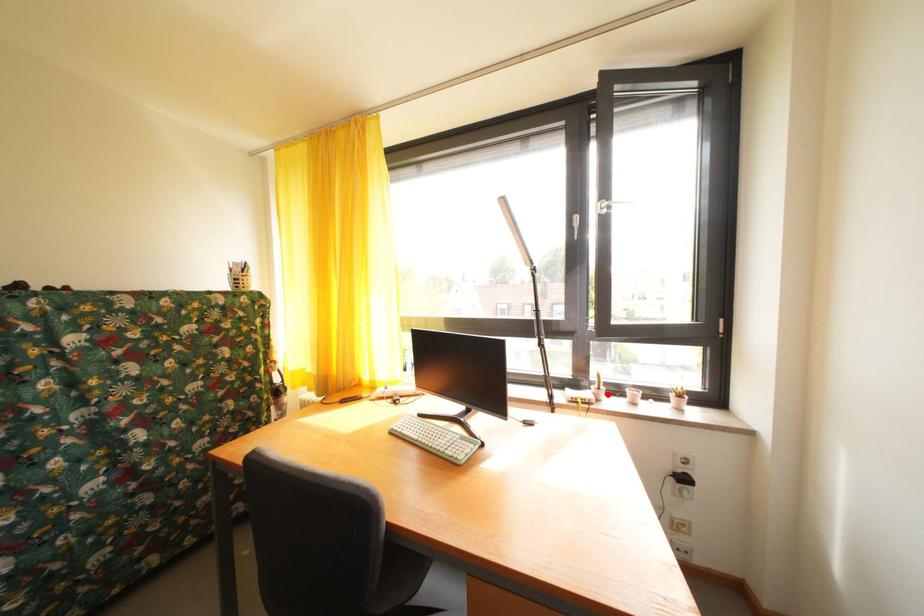
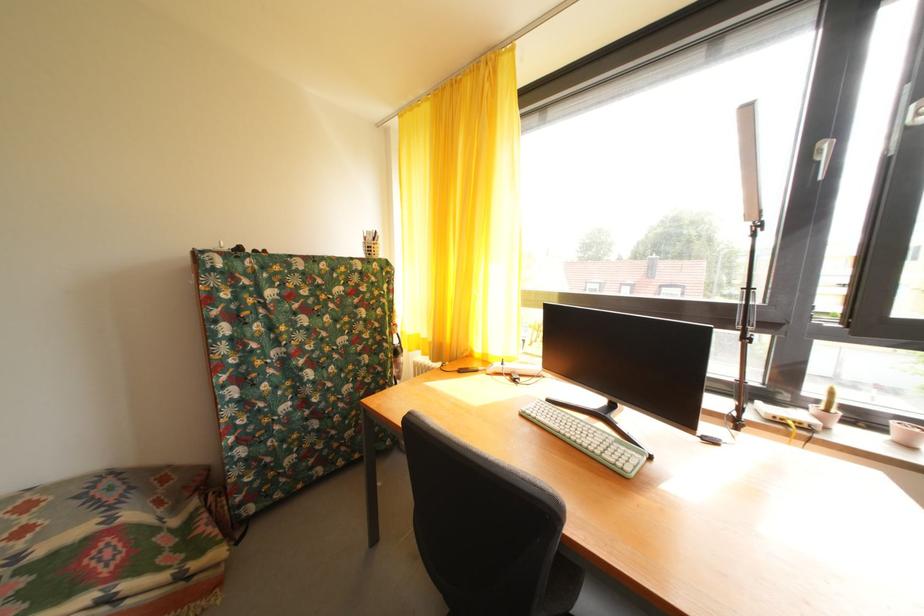
The point at the highlighted location is marked in the first image. Where is the corresponding point in the second image?

(836, 416)